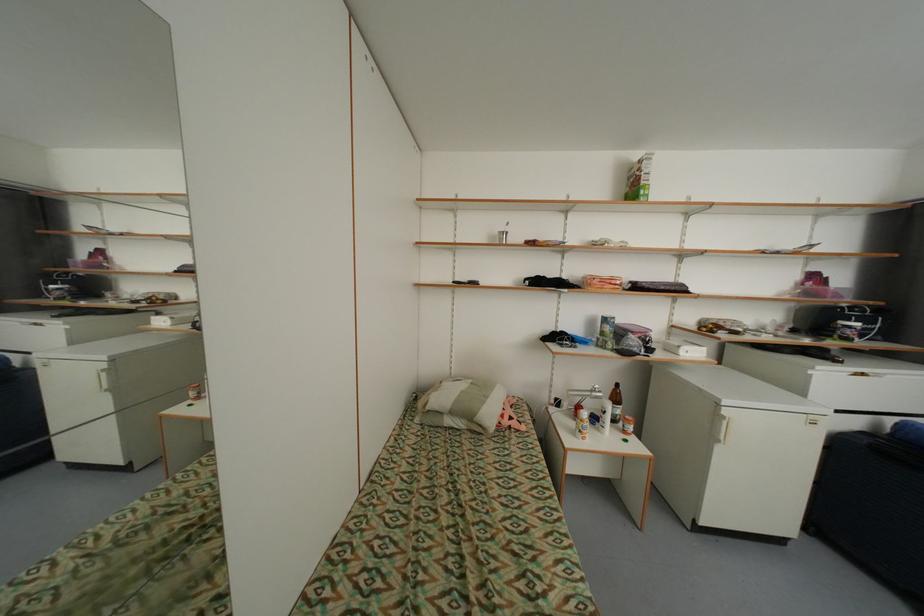
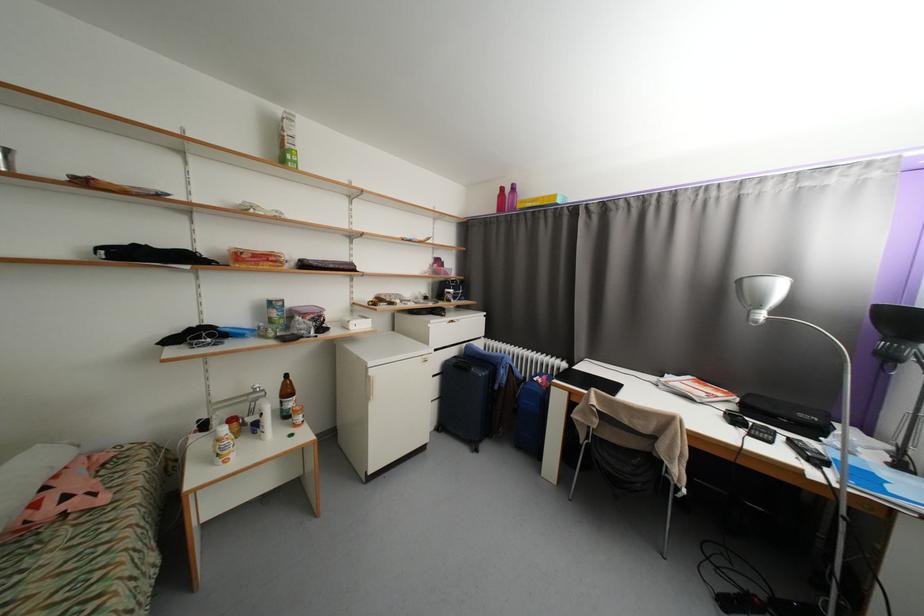
Find the pixel in the second image that matches the point at 723,418 in the first image.

(373, 379)